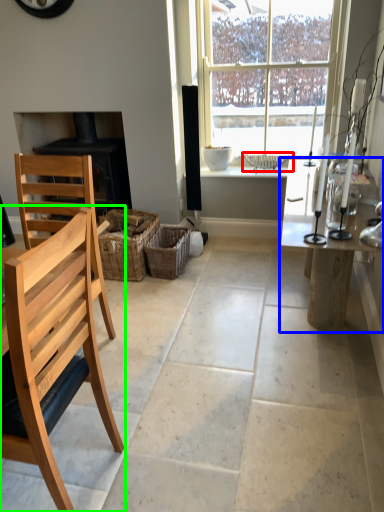
Question: Considering the real-world distances, which object is closest to basket (highlighted by a red box)? table (highlighted by a blue box) or chair (highlighted by a green box).

Choices:
 (A) table
 (B) chair

Answer: (A)